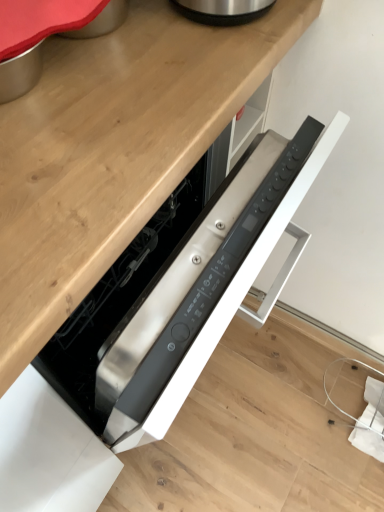
The width and height of the screenshot is (384, 512). Describe the element at coordinates (113, 150) in the screenshot. I see `wooden at upper left` at that location.

Locate an element on the screen. wooden at upper left is located at coordinates (113, 150).

Image resolution: width=384 pixels, height=512 pixels. Identify the location of wooden at upper left. (113, 150).